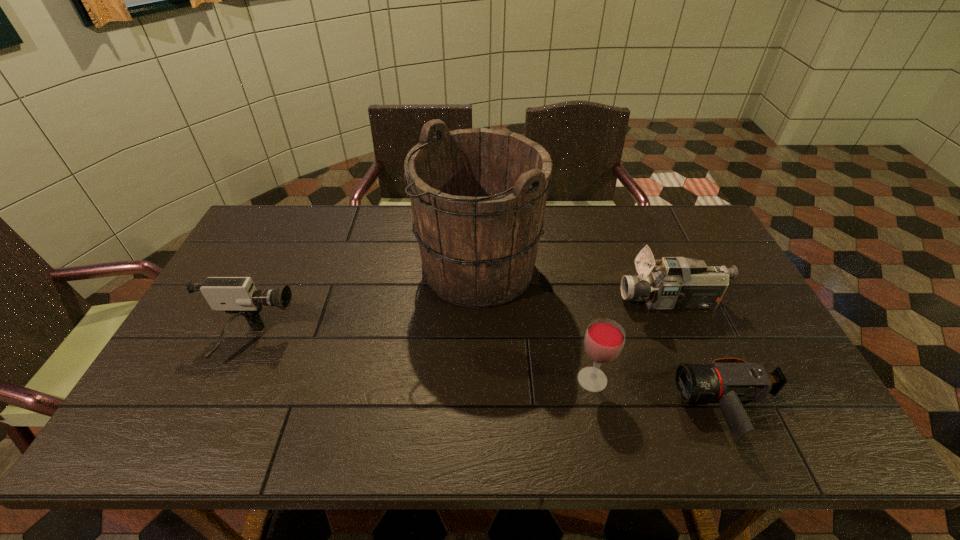
Image resolution: width=960 pixels, height=540 pixels. Find the location of `the tallest object`. the tallest object is located at coordinates (478, 196).

You are a GUI agent. You are given a task and a screenshot of the screen. Output one action in this format:
    pyautogui.click(x=<x>, y=<y>)
    Task: Click on the bucket
    This screenshot has width=960, height=540.
    Given the screenshot: What is the action you would take?
    pyautogui.click(x=478, y=196)

Find the location of `wineglass`. wineglass is located at coordinates (604, 340).

In order to click on the leftmost camcorder in this screenshot , I will do click(x=238, y=296).

This screenshot has width=960, height=540. In order to click on the shortest object in this screenshot , I will do `click(729, 381)`.

Locate an element on the screen. the shortest camcorder is located at coordinates (729, 381).

I want to click on vacant area located on the right of the tallest object, so click(x=663, y=268).

Find the location of `vacant space located on the left of the third object from left to right`. vacant space located on the left of the third object from left to right is located at coordinates (531, 380).

Locate an element on the screen. This screenshot has width=960, height=540. free space located on the recording direction of the leftmost camcorder is located at coordinates (391, 342).

Identify the location of free spot located on the lens of the nearest camcorder. The width and height of the screenshot is (960, 540). (576, 407).